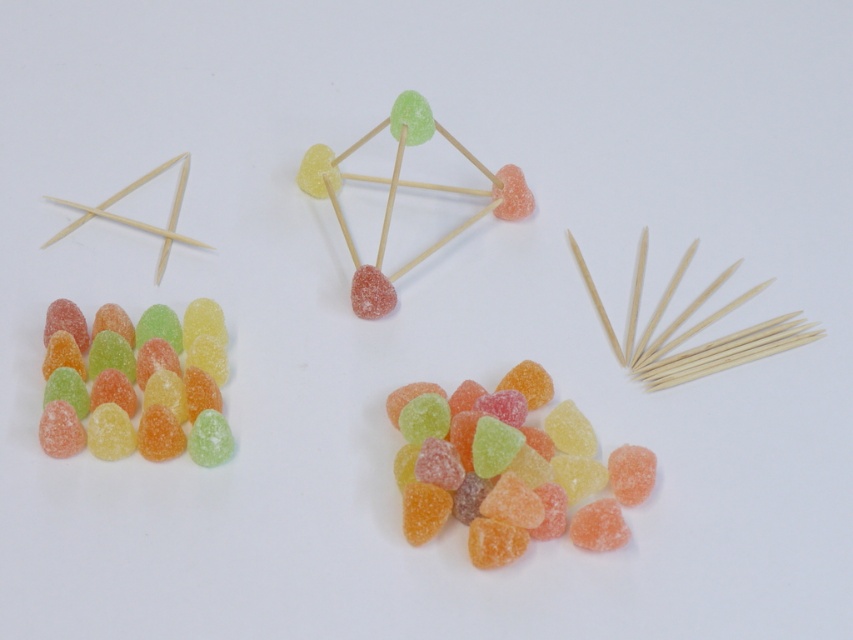
From the picture: You are looking at the tetrahedron structure made of toothpicks and gummy candies. There are two points labeled as point (x=502, y=401) and point (x=93, y=369). Which of these two points is closer to you?

Point (x=502, y=401) is closer to the camera than point (x=93, y=369).